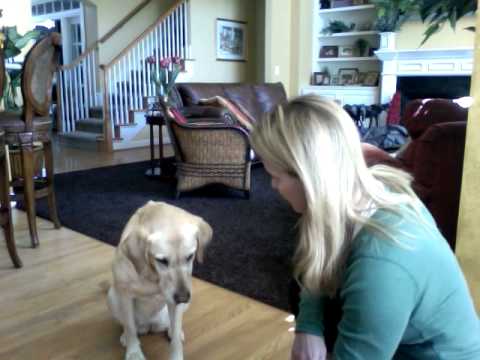
I want to click on fireplace, so click(435, 89).